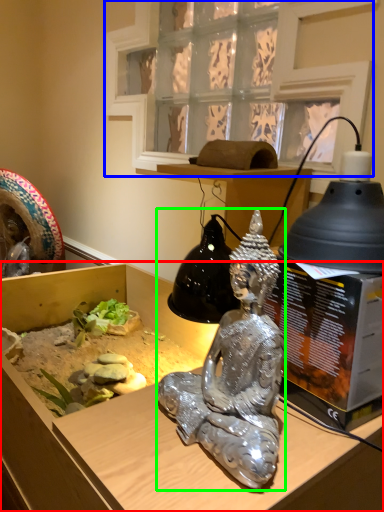
Question: Based on their relative distances, which object is farther from furniture (highlighted by a red box)? Choose from window (highlighted by a blue box) and person (highlighted by a green box).

Choices:
 (A) window
 (B) person

Answer: (A)